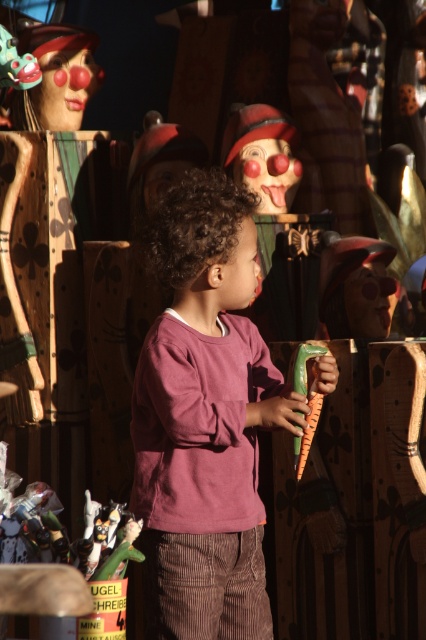
You are a photographer trying to capture the purple cotton shirt at center and the matte plastic clown head at upper left in the same frame. Based on their positions, which object should you adjust your camera to focus on first if you want to include both in the photo?

The purple cotton shirt at center is to the right of the matte plastic clown head at upper left, so you should focus on the matte plastic clown head at upper left first to ensure both are in the frame.

You are a photographer who wants to capture the purple cotton shirt at center in the image. According to the coordinates provided, where should you focus your camera lens?

The purple cotton shirt at center is located at coordinates point [204,419], so you should focus your camera lens there.